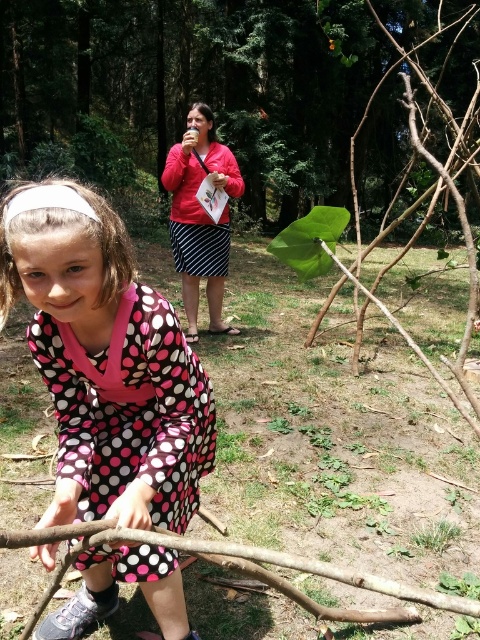
Is green leafy plant at upper center below brown rough tree branch at center right?

Incorrect, green leafy plant at upper center is not positioned below brown rough tree branch at center right.

Does point (255, 172) lie in front of point (324, 308)?

No, (255, 172) is behind (324, 308).

Locate an element on the screen. The width and height of the screenshot is (480, 640). green leafy plant at upper center is located at coordinates coord(189,92).

Is brown rough tree branch at lower center further to the viewer compared to brown rough tree branch at center right?

No, brown rough tree branch at lower center is in front of brown rough tree branch at center right.

Does brown rough tree branch at lower center have a greater height compared to brown rough tree branch at center right?

Incorrect, brown rough tree branch at lower center's height is not larger of brown rough tree branch at center right's.

Identify the location of brown rough tree branch at lower center. The height and width of the screenshot is (640, 480). (240, 570).

Identify the location of brown rough tree branch at lower center. (240, 570).

Between pink polka dot dress at lower left and brown rough tree branch at center right, which one is positioned higher?

brown rough tree branch at center right

Between pink polka dot dress at lower left and brown rough tree branch at center right, which one appears on the left side from the viewer's perspective?

From the viewer's perspective, pink polka dot dress at lower left appears more on the left side.

Is point (88, 564) closer to camera compared to point (416, 45)?

Yes, point (88, 564) is in front of point (416, 45).

Find the location of a particular element. pink polka dot dress at lower left is located at coordinates (106, 362).